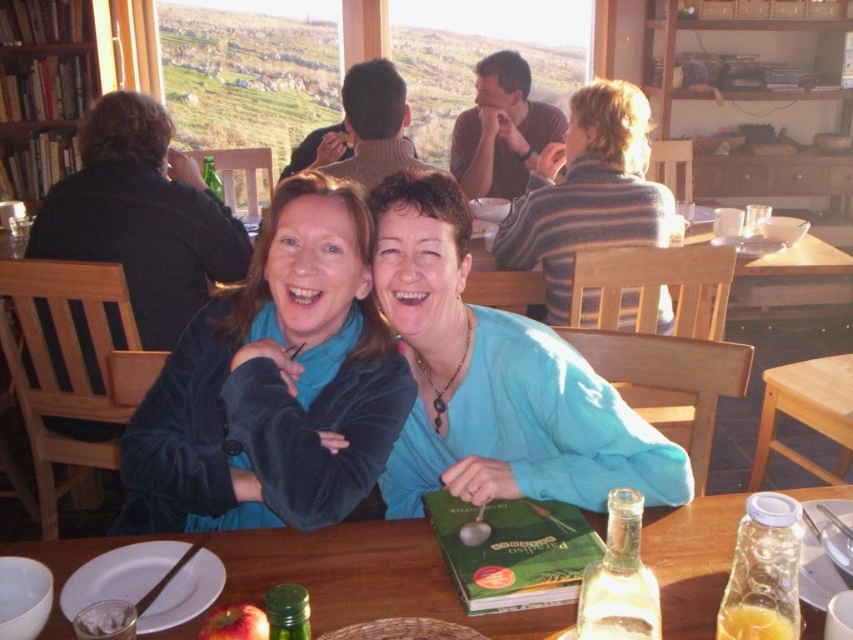
Can you confirm if velvet blue sweater at center is wider than blue fabric shirt at center?

Yes, velvet blue sweater at center is wider than blue fabric shirt at center.

Does velvet blue sweater at center have a greater height compared to blue fabric shirt at center?

Correct, velvet blue sweater at center is much taller as blue fabric shirt at center.

Between point (271, 211) and point (650, 444), which one is positioned in front?

Point (650, 444)

Where is `velvet blue sweater at center`? The height and width of the screenshot is (640, 853). velvet blue sweater at center is located at coordinates (273, 384).

Who is higher up, blue fabric shirt at center or wooden bookshelf at upper left?

wooden bookshelf at upper left

Describe the element at coordinates (495, 380) in the screenshot. I see `blue fabric shirt at center` at that location.

Identify the location of blue fabric shirt at center. (495, 380).

Does wooden bookshelf at upper left appear under red smooth apple at lower left?

Actually, wooden bookshelf at upper left is above red smooth apple at lower left.

Between point (20, 104) and point (262, 612), which one is positioned in front?

Point (262, 612) is more forward.

The width and height of the screenshot is (853, 640). Identify the location of wooden bookshelf at upper left. (42, 86).